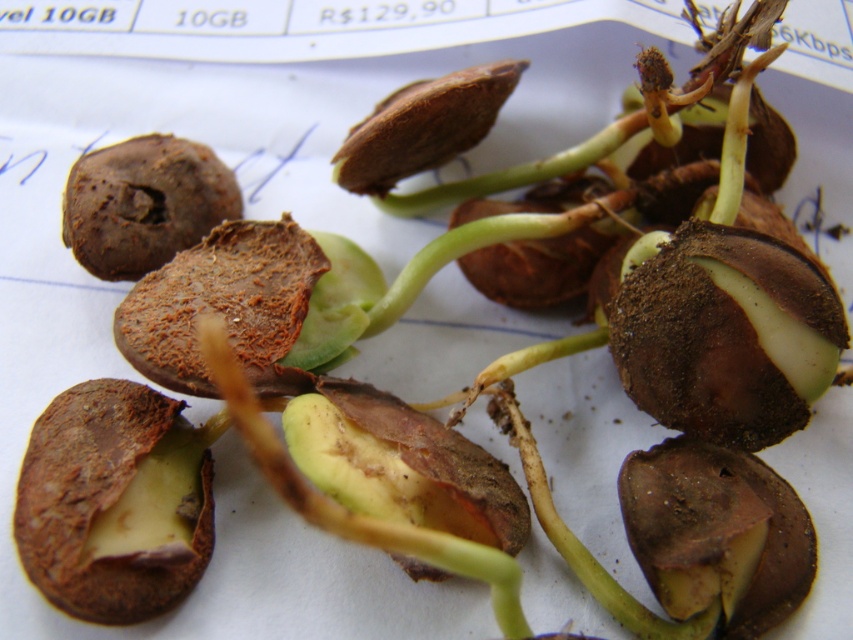
Question: Which point is farther to the camera?

Choices:
 (A) brown matte seedling at center-right
 (B) brown matte seed at center

Answer: (A)

Question: Does brown matte seedling at center-right appear on the right side of brown matte seed at center?

Choices:
 (A) no
 (B) yes

Answer: (B)

Question: Among these objects, which one is farthest from the camera?

Choices:
 (A) brown matte seed at center
 (B) brown matte seedling at center-right

Answer: (B)

Question: Does brown matte seedling at center-right appear over brown matte seed at center?

Choices:
 (A) yes
 (B) no

Answer: (A)

Question: Which object is closer to the camera taking this photo?

Choices:
 (A) brown matte seedling at center-right
 (B) brown matte seed at center

Answer: (B)

Question: Is brown matte seedling at center-right further to the viewer compared to brown matte seed at center?

Choices:
 (A) no
 (B) yes

Answer: (B)